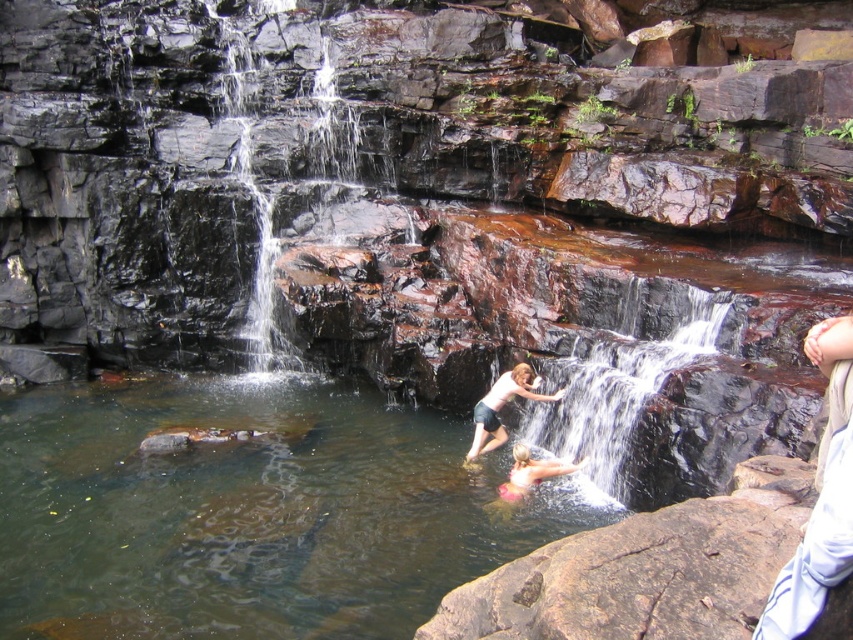
Question: Where is white cotton shirt at right located in relation to pink fabric at lower center in the image?

Choices:
 (A) above
 (B) below

Answer: (A)

Question: Can you confirm if white cotton shirt at right is bigger than pink fabric at lower center?

Choices:
 (A) no
 (B) yes

Answer: (B)

Question: Is smooth rock waterfall at center bigger than pink fabric at lower center?

Choices:
 (A) yes
 (B) no

Answer: (A)

Question: Which of these objects is positioned farthest from the pink fabric at lower center?

Choices:
 (A) white cotton shirt at right
 (B) smooth rock waterfall at center
 (C) clear water at center

Answer: (A)

Question: Which point is closer to the camera taking this photo?

Choices:
 (A) (496, 433)
 (B) (606, 384)
 (C) (544, 470)
 (D) (814, 552)

Answer: (D)

Question: Which point is closer to the camera?

Choices:
 (A) white cotton shirt at right
 (B) smooth rock waterfall at center
 (C) smooth skin child at center

Answer: (A)